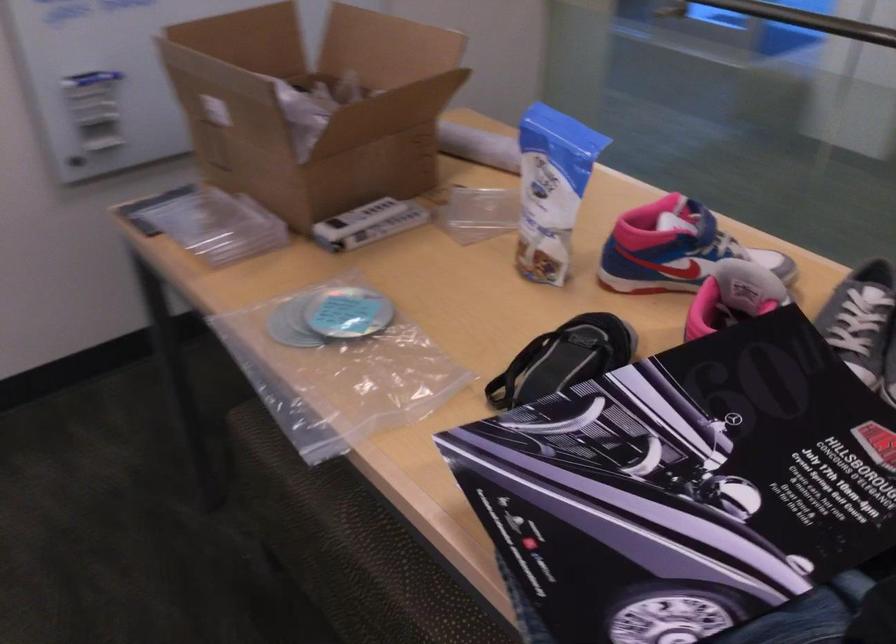
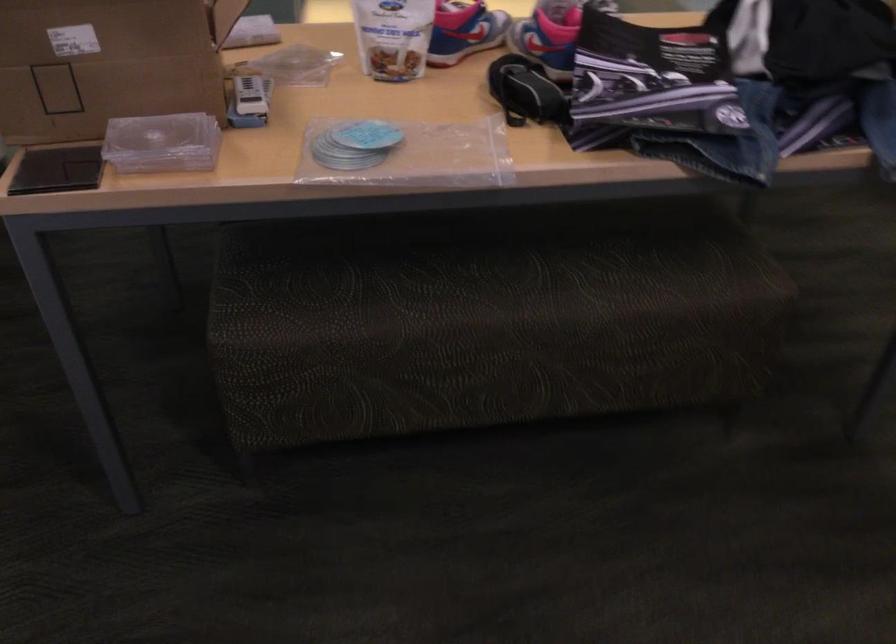
In the second image, find the point that corresponds to [329,223] in the first image.

(247, 99)